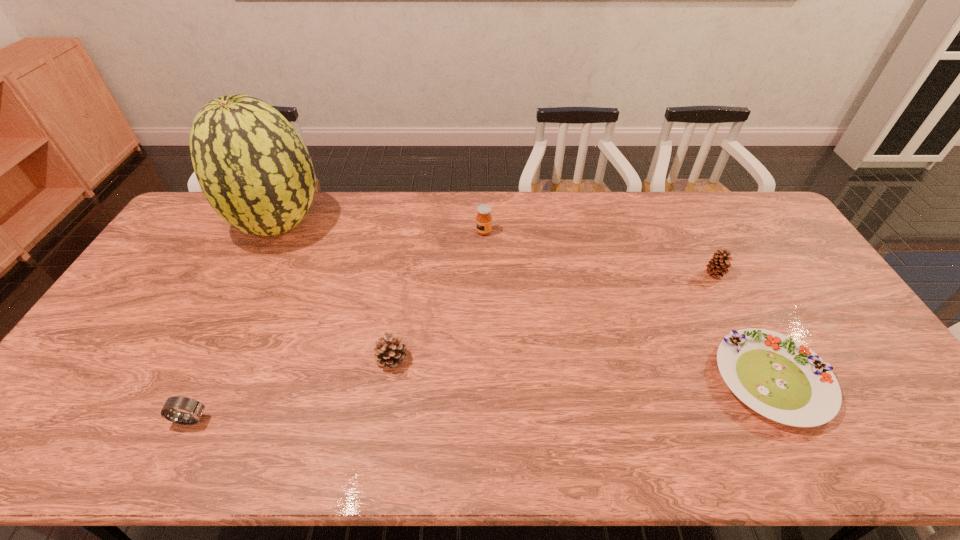
Locate an element on the screen. the tallest object is located at coordinates (252, 166).

At what (x,y) coordinates should I click in order to perform the action: click on the third farthest object. Please return your answer as a coordinate pair (x, y). Looking at the image, I should click on (719, 264).

This screenshot has height=540, width=960. In order to click on the farther pinecone in this screenshot , I will do `click(719, 264)`.

This screenshot has height=540, width=960. What are the coordinates of `the third object from right to left` in the screenshot? It's located at (483, 219).

You are a GUI agent. You are given a task and a screenshot of the screen. Output one action in this format:
    pyautogui.click(x=<x>, y=<y>)
    Task: Click on the third object from left to right
    The height and width of the screenshot is (540, 960).
    Given the screenshot: What is the action you would take?
    pyautogui.click(x=389, y=353)

This screenshot has height=540, width=960. What are the coordinates of `the nearer pinecone` in the screenshot? It's located at (389, 353).

The width and height of the screenshot is (960, 540). What are the coordinates of `watch` in the screenshot? It's located at (196, 408).

Locate an element on the screen. The image size is (960, 540). salad plate is located at coordinates (778, 377).

Image resolution: width=960 pixels, height=540 pixels. Find the location of `vacant space located on the right of the tallest object`. vacant space located on the right of the tallest object is located at coordinates (367, 225).

Where is `vacant point located 0.080m on the left of the third farthest object`? The width and height of the screenshot is (960, 540). vacant point located 0.080m on the left of the third farthest object is located at coordinates (680, 274).